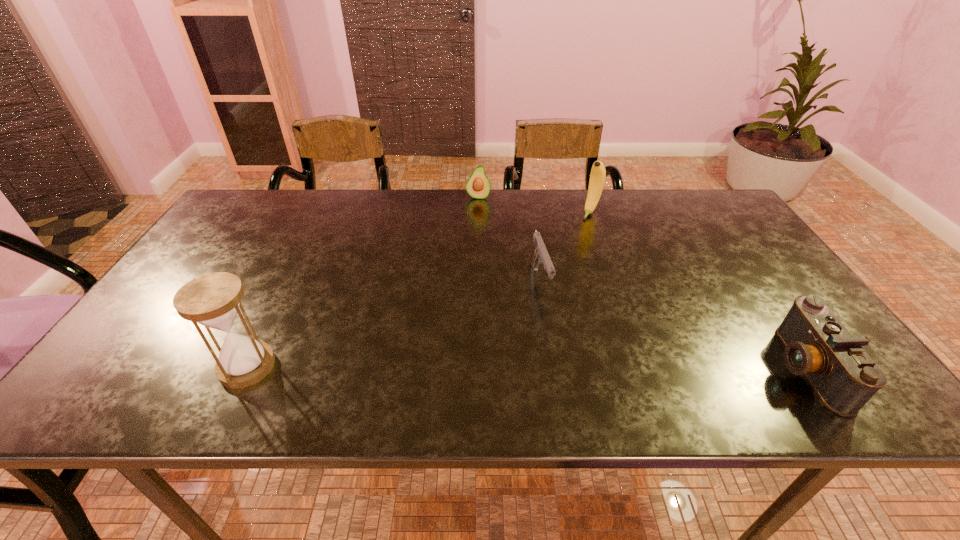
Identify the location of free space at the left edge. (239, 261).

This screenshot has height=540, width=960. I want to click on vacant space at the right edge of the desktop, so click(x=756, y=241).

I want to click on free space at the far right corner of the desktop, so click(710, 226).

Locate an element on the screen. The height and width of the screenshot is (540, 960). free space between the third farthest object and the second farthest object is located at coordinates (565, 247).

The height and width of the screenshot is (540, 960). In order to click on vacant space that is in between the rightmost object and the third farthest object in this screenshot , I will do `click(672, 324)`.

Locate an element on the screen. The width and height of the screenshot is (960, 540). free spot between the fourth shortest object and the fourth object from right to left is located at coordinates (535, 205).

Image resolution: width=960 pixels, height=540 pixels. Identify the location of free point between the farthest object and the fourth shortest object. (535, 205).

Identify the location of blank region between the farthest object and the camera. (641, 282).

Find the location of a particular element. The image size is (960, 540). free space between the fourth object from left to right and the second object from left to right is located at coordinates (535, 205).

Find the location of `vacant area between the second object from right to left and the fourth object from right to left`. vacant area between the second object from right to left and the fourth object from right to left is located at coordinates (535, 205).